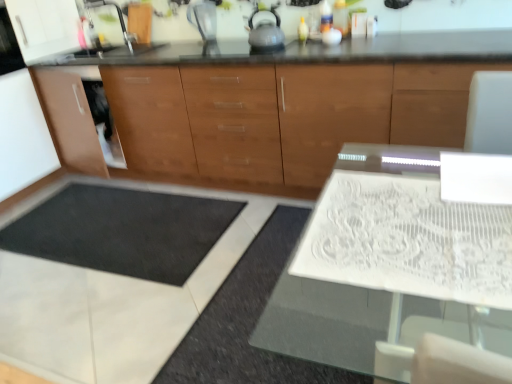
Question: Is transparent plastic blender at upper center to the left or to the right of brown wood cabinet at center in the image?

Choices:
 (A) left
 (B) right

Answer: (A)

Question: Considering the positions of point (196, 13) and point (301, 124), is point (196, 13) closer or farther from the camera than point (301, 124)?

Choices:
 (A) closer
 (B) farther

Answer: (B)

Question: Estimate the real-world distances between objects in this image. Which object is farther from the transparent plastic blender at upper center?

Choices:
 (A) satin silver tea pot at upper center
 (B) brown wood cabinet at center
 (C) white glass table at center

Answer: (C)

Question: Estimate the real-world distances between objects in this image. Which object is farther from the satin silver tea pot at upper center?

Choices:
 (A) transparent plastic blender at upper center
 (B) brown wood cabinet at center
 (C) white glass table at center

Answer: (C)